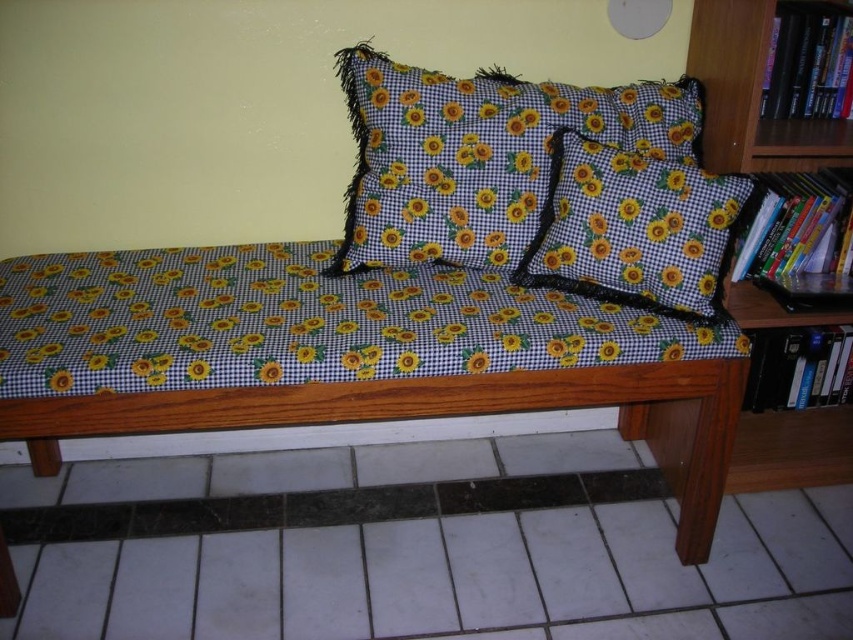
Who is positioned more to the left, black checkered pillow with sunflowers at center or hardcover book at right?

black checkered pillow with sunflowers at center

Is the position of black checkered pillow with sunflowers at center more distant than that of hardcover book at right?

No, it is not.

The height and width of the screenshot is (640, 853). Find the location of `black checkered pillow with sunflowers at center`. black checkered pillow with sunflowers at center is located at coordinates (480, 156).

Does wooden bench at center have a greater height compared to wooden bookshelf at right?

Yes, wooden bench at center is taller than wooden bookshelf at right.

What do you see at coordinates (347, 355) in the screenshot?
I see `wooden bench at center` at bounding box center [347, 355].

Is point (434, 387) farther from camera compared to point (694, 61)?

No, it is not.

Locate an element on the screen. Image resolution: width=853 pixels, height=640 pixels. wooden bench at center is located at coordinates (347, 355).

Does black checkered pillow with sunflowers at center have a larger size compared to yellow-green fabric pillow at center?

→ Indeed, black checkered pillow with sunflowers at center has a larger size compared to yellow-green fabric pillow at center.

Between black checkered pillow with sunflowers at center and yellow-green fabric pillow at center, which one is positioned higher?

black checkered pillow with sunflowers at center is higher up.

Does point (422, 116) come closer to viewer compared to point (686, 244)?

No, (422, 116) is behind (686, 244).

The width and height of the screenshot is (853, 640). In order to click on black checkered pillow with sunflowers at center in this screenshot , I will do `click(480, 156)`.